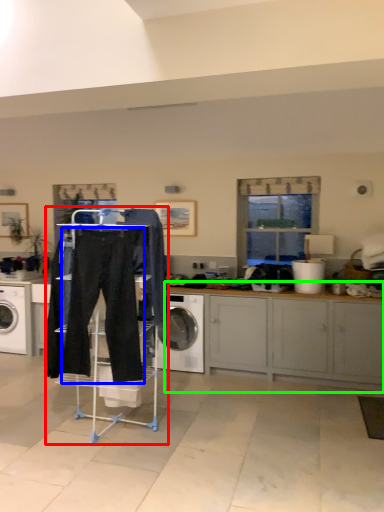
Question: Estimate the real-world distances between objects in this image. Which object is farther from closet (highlighted by a red box), sweat pant (highlighted by a blue box) or cabinetry (highlighted by a green box)?

Choices:
 (A) sweat pant
 (B) cabinetry

Answer: (B)